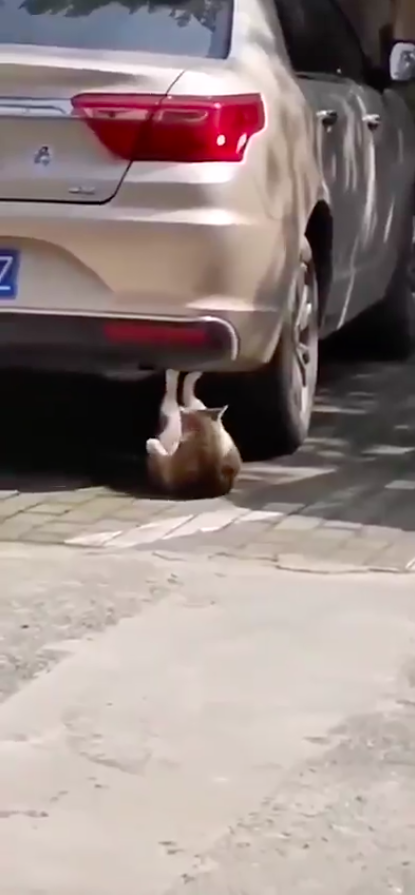
Locate an element on the screen. windows is located at coordinates (73, 21), (312, 49), (345, 38).